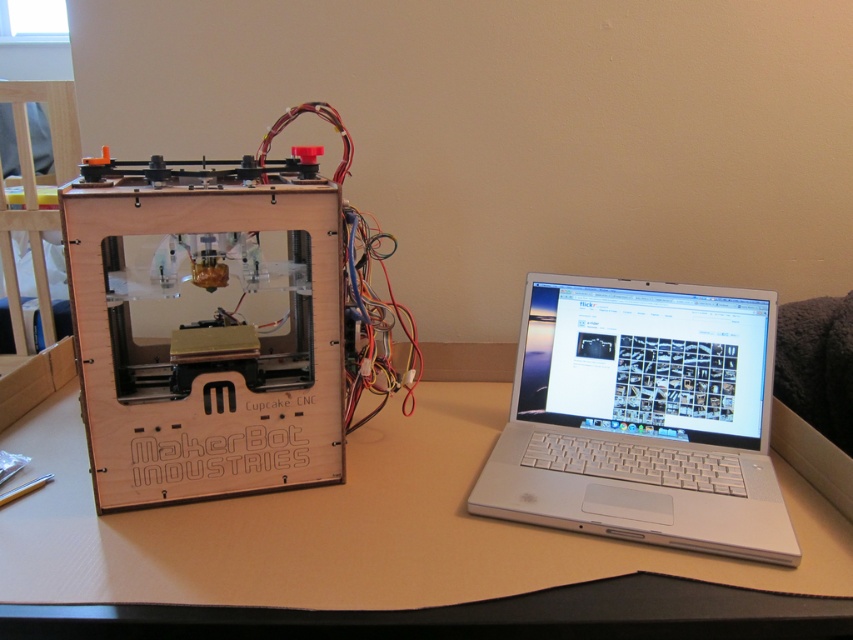
You are setting up a new 3D printer and need to place the silver metallic laptop at center on a stable surface. Is the light brown wood table at center a suitable surface to place the laptop?

The light brown wood table at center is positioned under silver metallic laptop at center, so yes, the laptop can be placed on the table since it is located underneath it.

You are setting up a 3D printer and need to place both the light brown wood table at center and the silver metallic laptop at center on your desk. Based on their heights, which one should you place first to ensure stability?

The light brown wood table at center is shorter than the silver metallic laptop at center. Since the table is shorter, you should place the silver metallic laptop at center first to ensure stability.